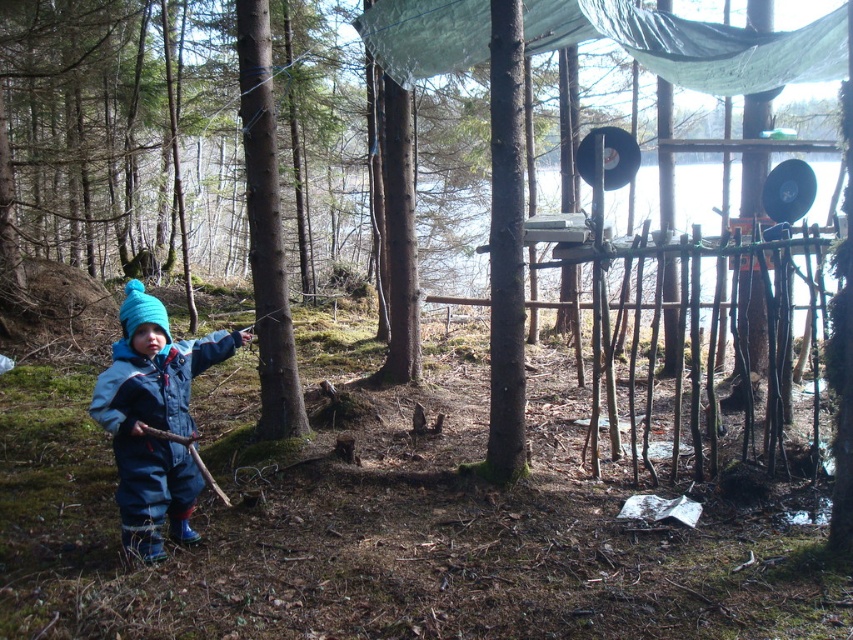
You are a hiker who just arrived at this forest scene. You see the transparent tarpaulin at upper center and the blue fleece jumpsuit at lower left. Which object is positioned to the right of the other?

The transparent tarpaulin at upper center is to the right of the blue fleece jumpsuit at lower left.